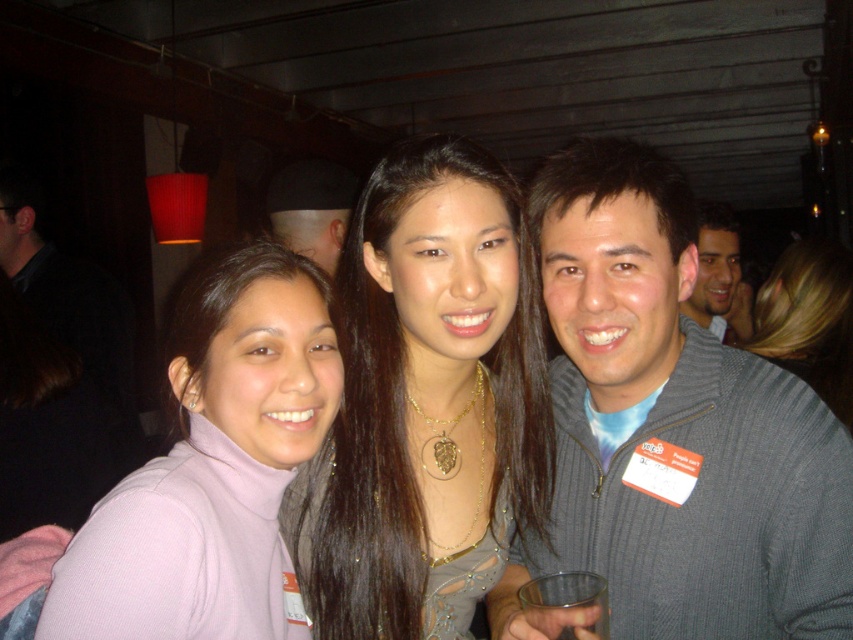
You are a photographer at the event and want to ensure both the gray ribbed sweater at center and the pink turtleneck sweater at center are clearly visible in the photo. Which sweater should you focus on first to ensure proper exposure, considering their sizes?

The gray ribbed sweater at center is larger in size than the pink turtleneck sweater at center, so focusing on the gray ribbed sweater at center first would ensure proper exposure due to its larger size.

You are a photographer who wants to ensure that both the shiny gold necklace at center and the shiny black hat at upper center are clearly visible in the photo. Given that the camera has a depth of field that can focus on objects within a 5 feet range, will both items be in focus?

The shiny gold necklace at center is 4.79 feet from the shiny black hat at upper center, which is within the 5 feet range. Therefore, both items will be in focus.

You are a photographer at the event and want to ensure that both the shiny gold necklace at center and the shiny black hat at upper center are clearly visible in the photo. Given their sizes, which object might require you to adjust your camera angle to avoid being too prominent?

The shiny gold necklace at center has a greater height compared to the shiny black hat at upper center, so it might require adjusting the camera angle to avoid being too prominent.